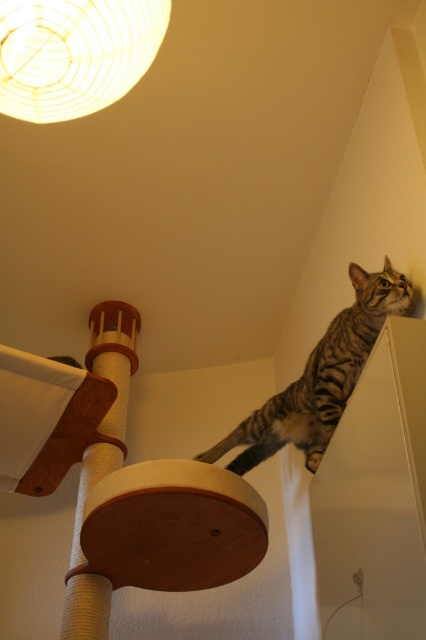
From the picture: Is tabby fur cat at upper right wider than sisal-covered scratching post at lower left?

Yes, tabby fur cat at upper right is wider than sisal-covered scratching post at lower left.

Can you confirm if tabby fur cat at upper right is positioned to the right of sisal-covered scratching post at lower left?

Indeed, tabby fur cat at upper right is positioned on the right side of sisal-covered scratching post at lower left.

Find the location of `tabby fur cat at upper right`. tabby fur cat at upper right is located at coordinates (319, 378).